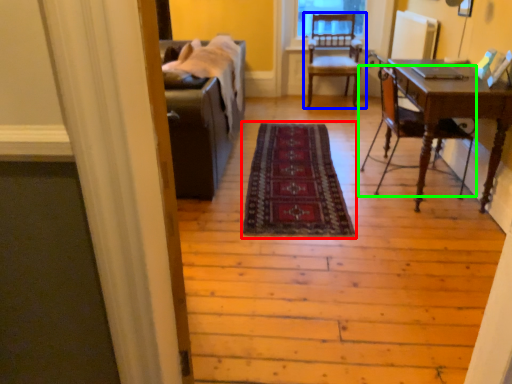
Question: Based on their relative distances, which object is farther from mat (highlighted by a red box)? Choose from chair (highlighted by a blue box) and chair (highlighted by a green box).

Choices:
 (A) chair
 (B) chair

Answer: (A)